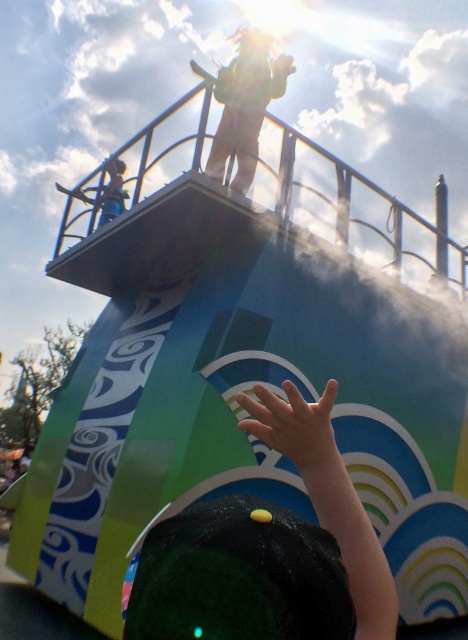
You are a photographer at the water park and want to capture both the dark green fabric hand at lower center and the light skin hand at center in the same frame. Based on their sizes in the photo, which hand should you focus on to ensure both are clearly visible?

Since the dark green fabric hand at lower center is larger in size than the light skin hand at center, you should focus on the dark green fabric hand at lower center to ensure both are clearly visible in the frame.

You are a safety inspector checking the water park. You notice the dark green fabric hand at lower center and the metallic silver helmet at upper left in the scene. Which object is located to the right of the other?

The dark green fabric hand at lower center is positioned on the right side of metallic silver helmet at upper left.